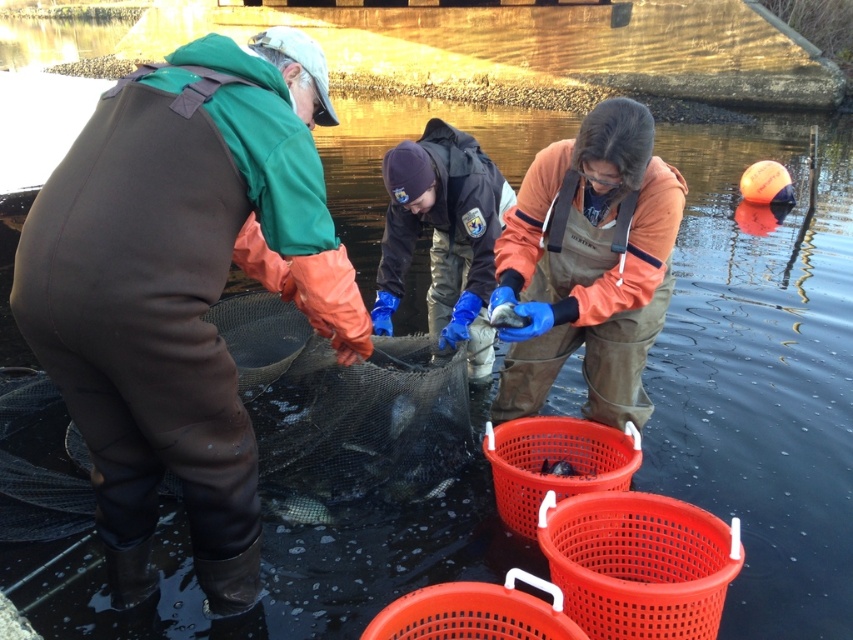
Who is lower down, brown rubber net at center or smooth gray fish at center?

smooth gray fish at center is below.

Does point (35, 520) come farther from viewer compared to point (399, 396)?

No.

Locate an element on the screen. Image resolution: width=853 pixels, height=640 pixels. brown rubber net at center is located at coordinates (341, 404).

Does shiny silver fish at center appear under smooth gray fish at center?

Yes, shiny silver fish at center is below smooth gray fish at center.

Is shiny silver fish at center to the right of smooth gray fish at center from the viewer's perspective?

No, shiny silver fish at center is not to the right of smooth gray fish at center.

Does point (318, 509) come farther from viewer compared to point (393, 435)?

No, it is in front of (393, 435).

Find the location of a particular element. shiny silver fish at center is located at coordinates (299, 508).

What do you see at coordinates (183, 288) in the screenshot?
I see `brown waterproof overalls at left` at bounding box center [183, 288].

Describe the element at coordinates (183, 288) in the screenshot. I see `brown waterproof overalls at left` at that location.

At what (x,y) coordinates should I click in order to perform the action: click on brown waterproof overalls at left. Please return your answer as a coordinate pair (x, y). This screenshot has width=853, height=640. Looking at the image, I should click on (183, 288).